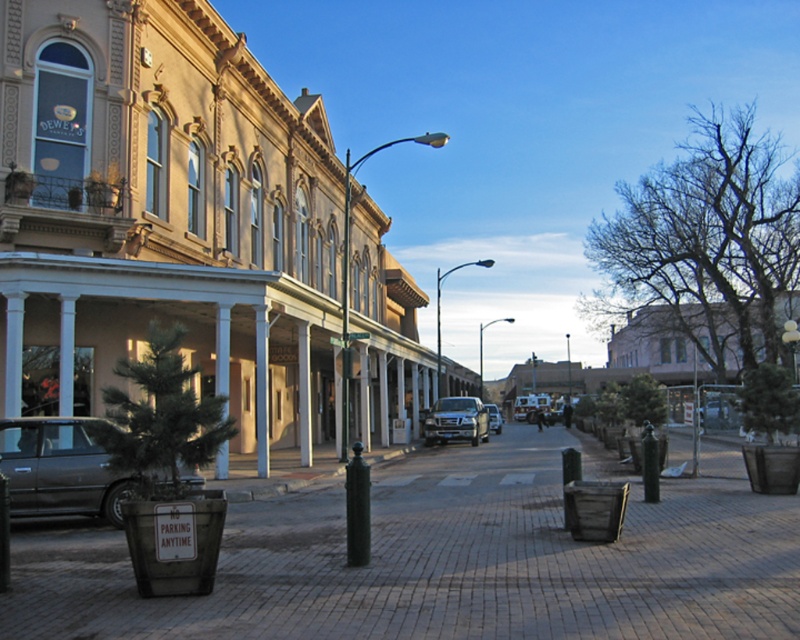
Question: Can you confirm if brick pavement at center is positioned above metallic silver truck at center?

Choices:
 (A) no
 (B) yes

Answer: (B)

Question: Based on their relative distances, which object is farther from the metallic silver suv at center?

Choices:
 (A) satin black suv at center
 (B) brushed metal pillar at center
 (C) matte black car at left
 (D) metallic silver truck at center

Answer: (C)

Question: Which point is farther to the camera?

Choices:
 (A) (517, 401)
 (B) (462, 404)
 (C) (490, 428)
 (D) (222, 461)

Answer: (A)

Question: Does brushed metal pillar at center appear over metallic silver truck at center?

Choices:
 (A) no
 (B) yes

Answer: (B)

Question: Which object is farther from the camera taking this photo?

Choices:
 (A) brushed metal pillar at center
 (B) metallic silver suv at center
 (C) brick pavement at center
 (D) satin black suv at center

Answer: (B)

Question: Does matte black car at left have a greater width compared to brushed metal pillar at center?

Choices:
 (A) yes
 (B) no

Answer: (B)